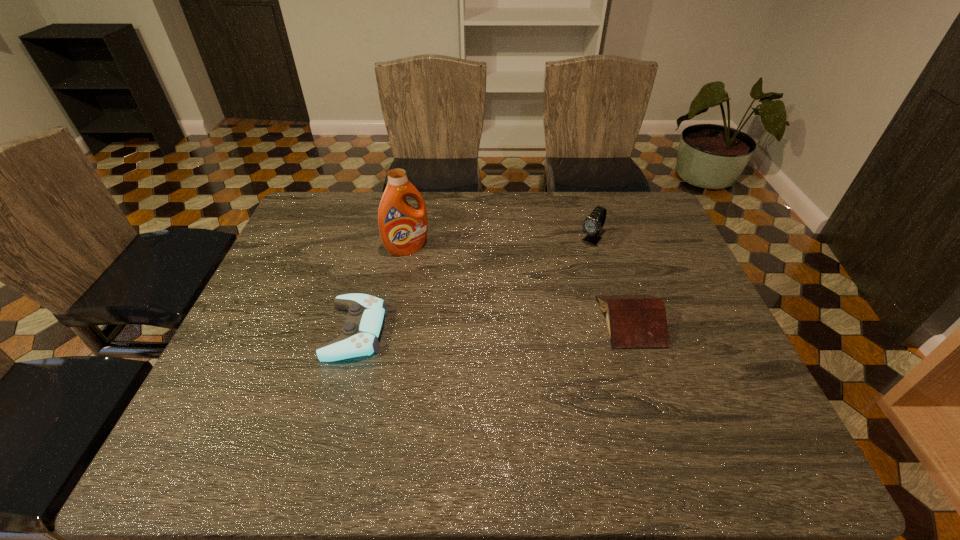
Find the location of a particular element. This screenshot has width=960, height=540. free space on the desktop that is between the control and the book and is positioned on the face of the third shortest object is located at coordinates (510, 325).

Identify the location of vacant space on the desktop that is between the control and the book and is positioned on the front-facing side of the tallest object. The width and height of the screenshot is (960, 540). (465, 327).